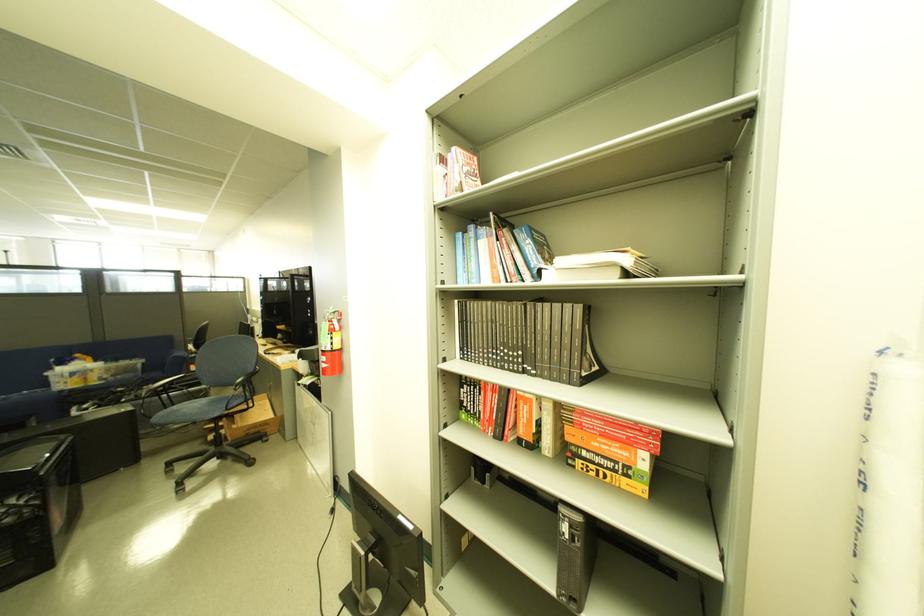
Find the location of a particular element. white paperback book is located at coordinates (601, 265).